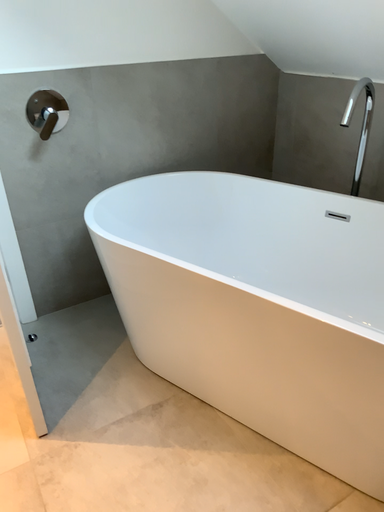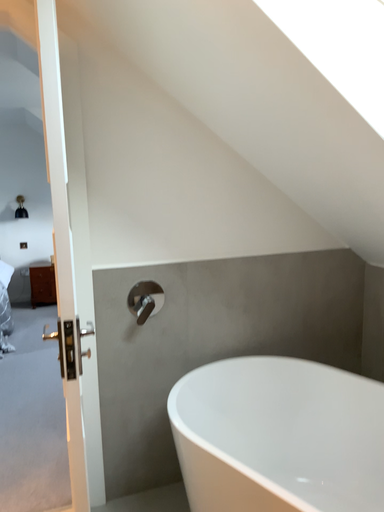
Question: Which way did the camera rotate in the video?

Choices:
 (A) rotated upward
 (B) rotated downward

Answer: (A)